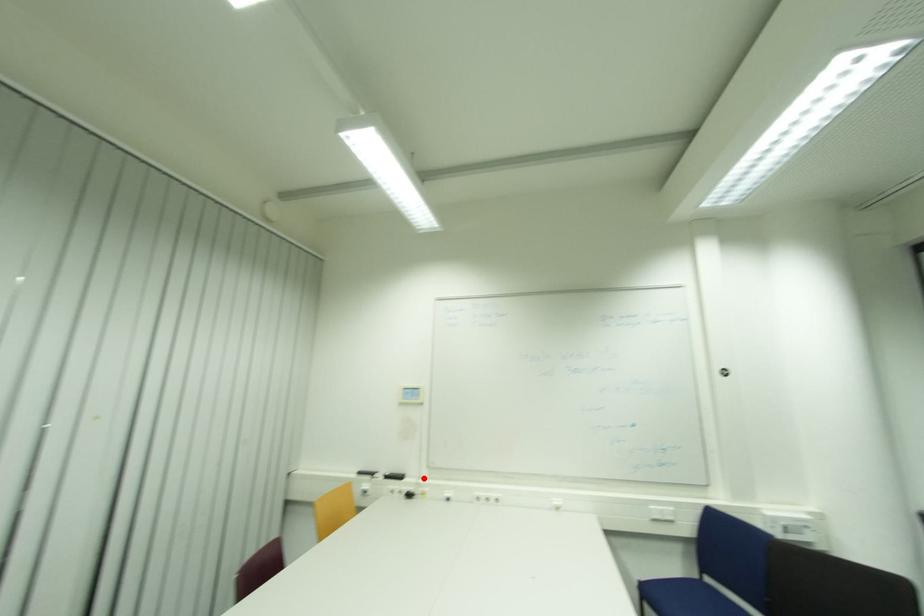
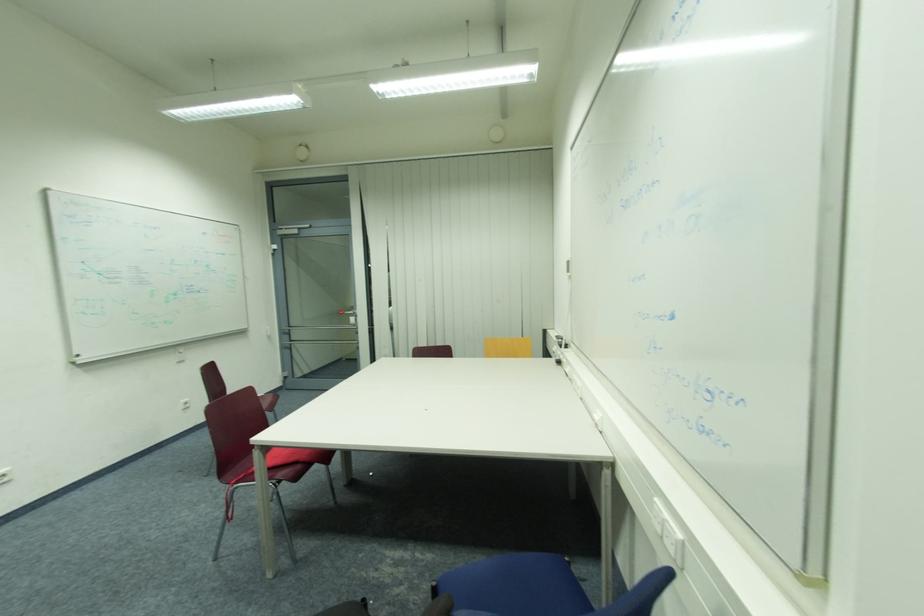
Question: I am providing you with two images of the same scene from different viewpoints. Image1 has a red point marked. In image2, the corresponding 3D location appears at what relative position? Reply with the corresponding letter.

Choices:
 (A) Closer
 (B) Farther

Answer: (A)